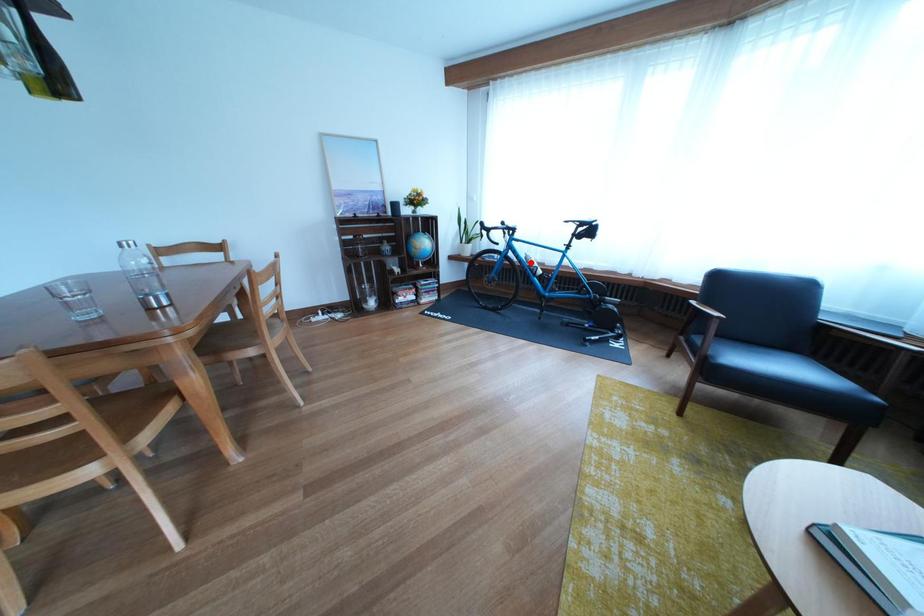
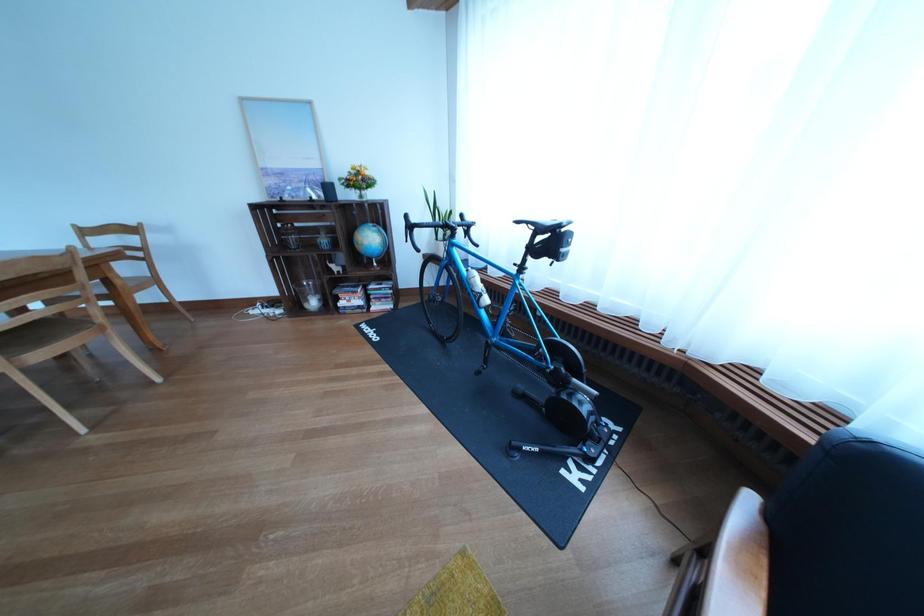
Question: I am providing you with two images of the same scene from different viewpoints. A red point is shown in image1. For the corresponding object point in image2, is it positioned nearer or farther from the camera?

Choices:
 (A) Nearer
 (B) Farther

Answer: (B)